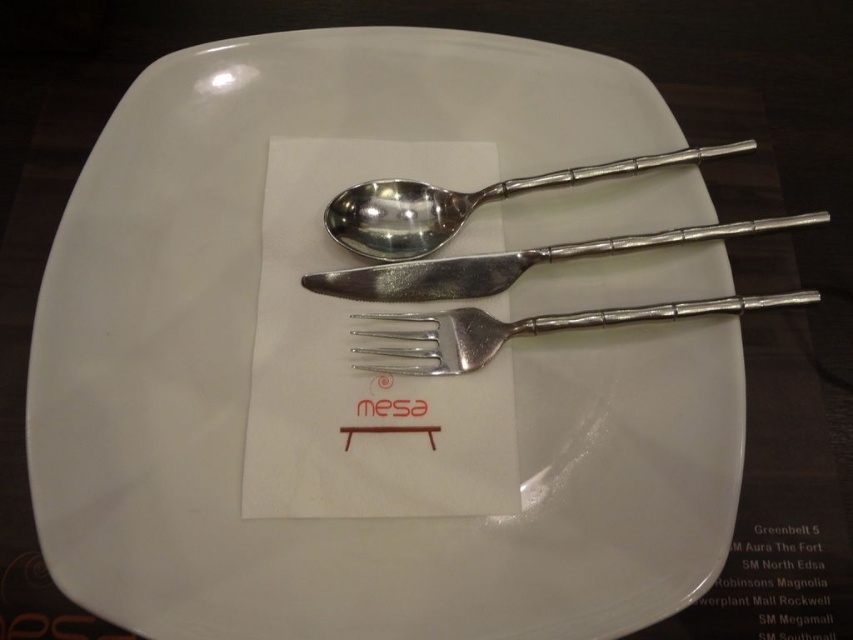
Who is taller, polished metal spoon at center or polished silver knife at center?

Standing taller between the two is polished metal spoon at center.

Which is below, polished metal spoon at center or polished silver knife at center?

polished silver knife at center is below.

Locate an element on the screen. The image size is (853, 640). polished metal spoon at center is located at coordinates (462, 202).

Is polished metal spoon at center above silver metallic fork at center?

Yes, polished metal spoon at center is above silver metallic fork at center.

Is point (427, 246) positioned in front of point (741, 305)?

No, (427, 246) is further to viewer.

The image size is (853, 640). What do you see at coordinates (462, 202) in the screenshot?
I see `polished metal spoon at center` at bounding box center [462, 202].

This screenshot has width=853, height=640. In order to click on polished metal spoon at center in this screenshot , I will do `click(462, 202)`.

Does polished silver knife at center appear over silver metallic fork at center?

Yes.

Is polished silver knife at center bigger than silver metallic fork at center?

No, polished silver knife at center is not bigger than silver metallic fork at center.

Is point (611, 244) less distant than point (403, 369)?

No, (611, 244) is further to viewer.

The height and width of the screenshot is (640, 853). I want to click on polished silver knife at center, so click(x=514, y=262).